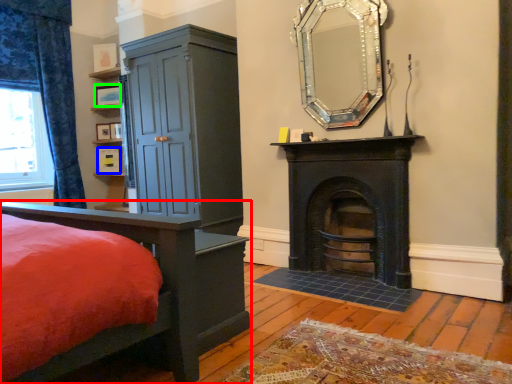
Question: Which is nearer to the bed (highlighted by a red box)? picture frame (highlighted by a blue box) or picture frame (highlighted by a green box).

Choices:
 (A) picture frame
 (B) picture frame

Answer: (A)